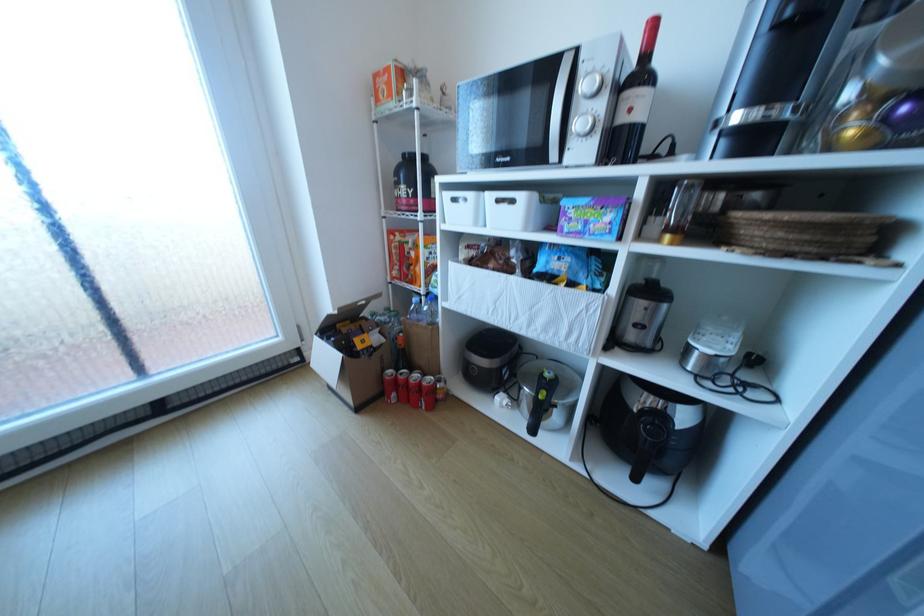
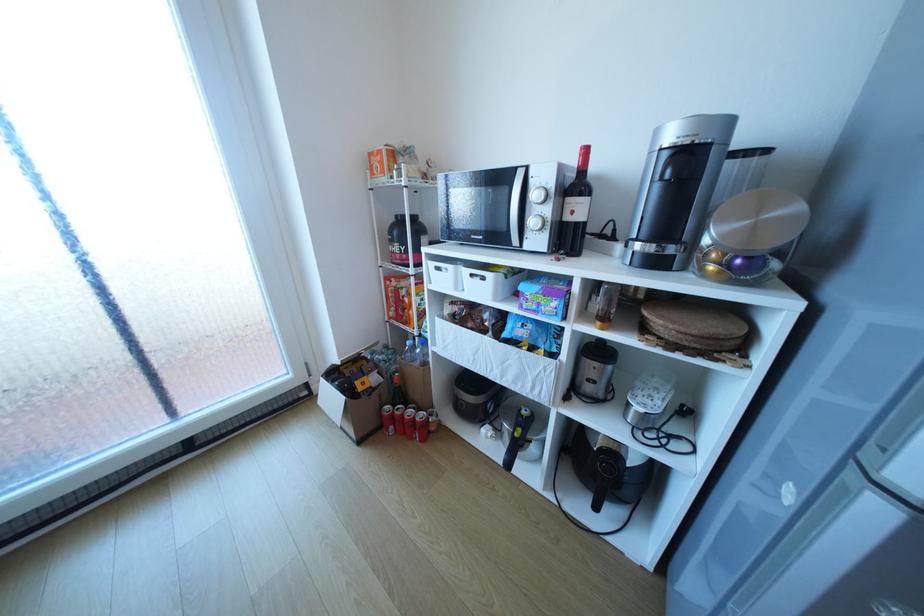
Where in the second image is the point corresponding to point 426,407 from the first image?

(420, 438)